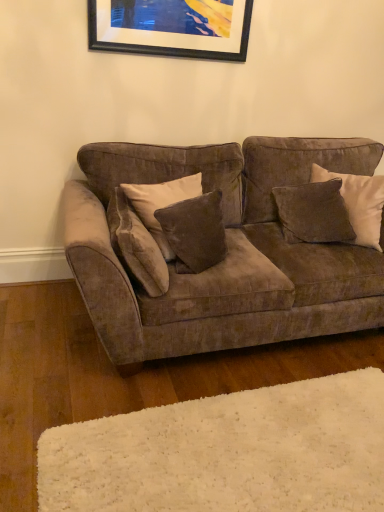
Question: From the image's perspective, is black matte picture frame at upper center under velvet brown couch at center?

Choices:
 (A) yes
 (B) no

Answer: (B)

Question: Is the depth of black matte picture frame at upper center greater than that of velvet brown couch at center?

Choices:
 (A) yes
 (B) no

Answer: (A)

Question: Is velvet brown couch at center a part of black matte picture frame at upper center?

Choices:
 (A) yes
 (B) no

Answer: (B)

Question: Is black matte picture frame at upper center not within velvet brown couch at center?

Choices:
 (A) yes
 (B) no

Answer: (A)

Question: Considering the relative sizes of black matte picture frame at upper center and velvet brown couch at center in the image provided, is black matte picture frame at upper center taller than velvet brown couch at center?

Choices:
 (A) yes
 (B) no

Answer: (B)

Question: From a real-world perspective, is black matte picture frame at upper center beneath velvet brown couch at center?

Choices:
 (A) no
 (B) yes

Answer: (A)

Question: Does velvet brown pillow at upper right, which appears as the 1th pillow when viewed from the right, have a greater width compared to velvet brown pillow at center, the third pillow viewed from the right?

Choices:
 (A) yes
 (B) no

Answer: (A)

Question: From a real-world perspective, is velvet brown pillow at upper right, which appears as the 1th pillow when viewed from the right, positioned under velvet brown pillow at center, the second pillow viewed from the left, based on gravity?

Choices:
 (A) yes
 (B) no

Answer: (A)

Question: From the image's perspective, is velvet brown pillow at upper right, the 4th pillow from the left, above velvet brown pillow at center, the second pillow viewed from the left?

Choices:
 (A) yes
 (B) no

Answer: (A)

Question: Is velvet brown pillow at center, the third pillow viewed from the right, inside velvet brown pillow at upper right, the 4th pillow from the left?

Choices:
 (A) no
 (B) yes

Answer: (A)

Question: From a real-world perspective, is velvet brown pillow at upper right, the 4th pillow from the left, over velvet brown pillow at center, the second pillow viewed from the left?

Choices:
 (A) no
 (B) yes

Answer: (A)

Question: Is velvet brown pillow at upper right, which appears as the 1th pillow when viewed from the right, taller than velvet brown pillow at center, the third pillow viewed from the right?

Choices:
 (A) yes
 (B) no

Answer: (A)

Question: Is black matte picture frame at upper center outside velvet brown pillow at center, the first pillow in the left-to-right sequence?

Choices:
 (A) no
 (B) yes

Answer: (B)